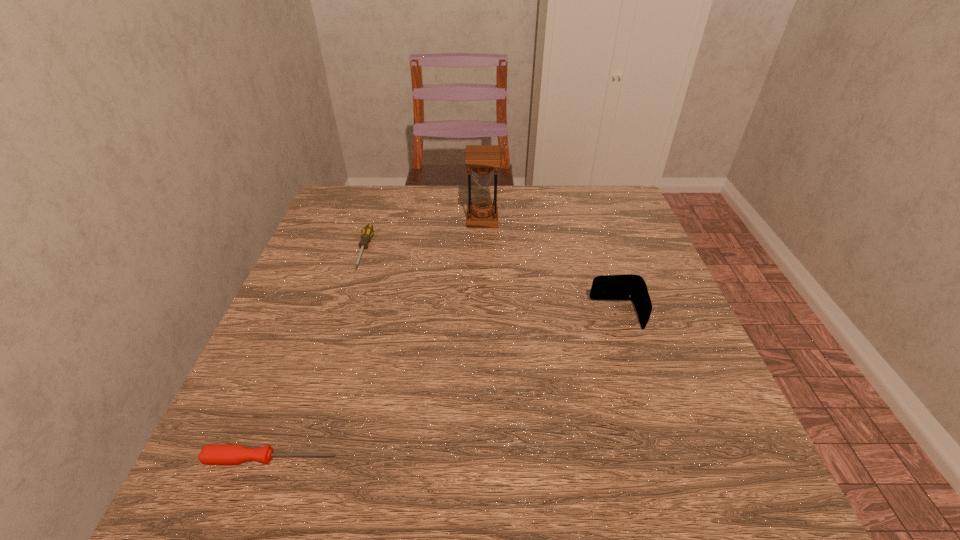
At what (x,y) coordinates should I click in order to perform the action: click on the farthest object. Please return your answer as a coordinate pair (x, y). Looking at the image, I should click on (482, 159).

Identify the location of hourglass. (482, 159).

Find the location of a particular element. the second tallest object is located at coordinates (631, 287).

Where is `the rightmost object`? Image resolution: width=960 pixels, height=540 pixels. the rightmost object is located at coordinates (631, 287).

Where is `the second farthest object`? The width and height of the screenshot is (960, 540). the second farthest object is located at coordinates (367, 232).

Find the location of a particular element. The image size is (960, 540). the second shortest object is located at coordinates (367, 232).

Image resolution: width=960 pixels, height=540 pixels. Identify the location of the shorter screwdriver. (221, 454).

Identify the location of the shortest object. The width and height of the screenshot is (960, 540). (221, 454).

Locate an element on the screen. vacant space located on the front of the third object from left to right is located at coordinates (483, 246).

Identify the location of vacant space located 0.090m on the outer surface of the wallet. The height and width of the screenshot is (540, 960). (549, 315).